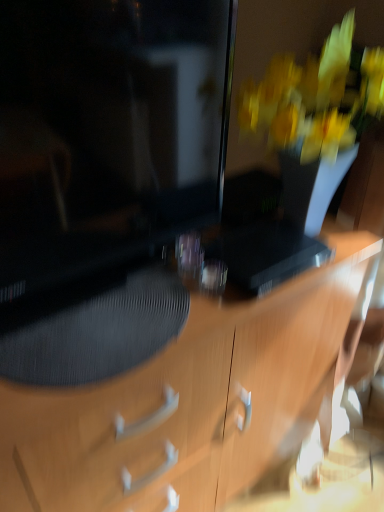
You are a GUI agent. You are given a task and a screenshot of the screen. Output one action in this format:
    pyautogui.click(x=<x>, y=<y>)
    Task: Click on the empty space that is ontop of wooden desk at center (from a real-world perspective)
    
    Given the screenshot: What is the action you would take?
    pyautogui.click(x=148, y=286)